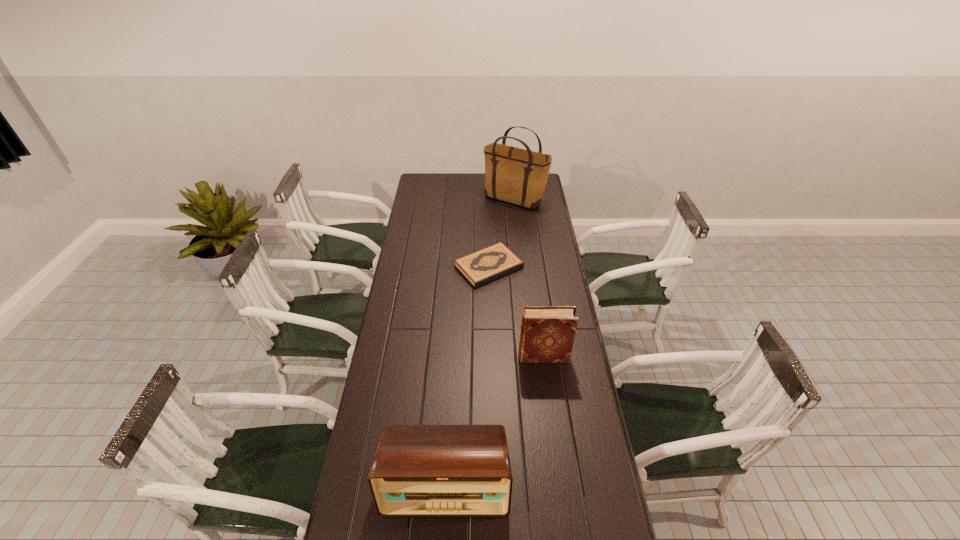
Where is `vacant area that lies between the nearer hardback book and the nearest object`? The width and height of the screenshot is (960, 540). vacant area that lies between the nearer hardback book and the nearest object is located at coordinates (494, 422).

The height and width of the screenshot is (540, 960). Find the location of `free spot between the third nearest object and the taller hardback book`. free spot between the third nearest object and the taller hardback book is located at coordinates (516, 312).

At what (x,y) coordinates should I click in order to perform the action: click on vacant space that's between the shorter hardback book and the nearer hardback book. Please return your answer as a coordinate pair (x, y). Looking at the image, I should click on (516, 312).

You are a GUI agent. You are given a task and a screenshot of the screen. Output one action in this format:
    pyautogui.click(x=<x>, y=<y>)
    Task: Click on the free space between the tote bag and the shorter hardback book
    
    Given the screenshot: What is the action you would take?
    pyautogui.click(x=501, y=233)

Where is `free space between the shortest object and the nearest object`? This screenshot has height=540, width=960. free space between the shortest object and the nearest object is located at coordinates (468, 377).

Find the location of a particular element. This screenshot has height=540, width=960. vacant space in between the third farthest object and the radio receiver is located at coordinates (494, 422).

The height and width of the screenshot is (540, 960). I want to click on free space between the farther hardback book and the taller hardback book, so click(x=516, y=312).

Where is `vacant area between the nearer hardback book and the tallest object`? The width and height of the screenshot is (960, 540). vacant area between the nearer hardback book and the tallest object is located at coordinates (529, 278).

This screenshot has width=960, height=540. Find the location of `vacant space that's between the third farthest object and the radio receiver`. vacant space that's between the third farthest object and the radio receiver is located at coordinates (494, 422).

The height and width of the screenshot is (540, 960). In order to click on free area in between the third nearest object and the nearest object in this screenshot , I will do `click(468, 377)`.